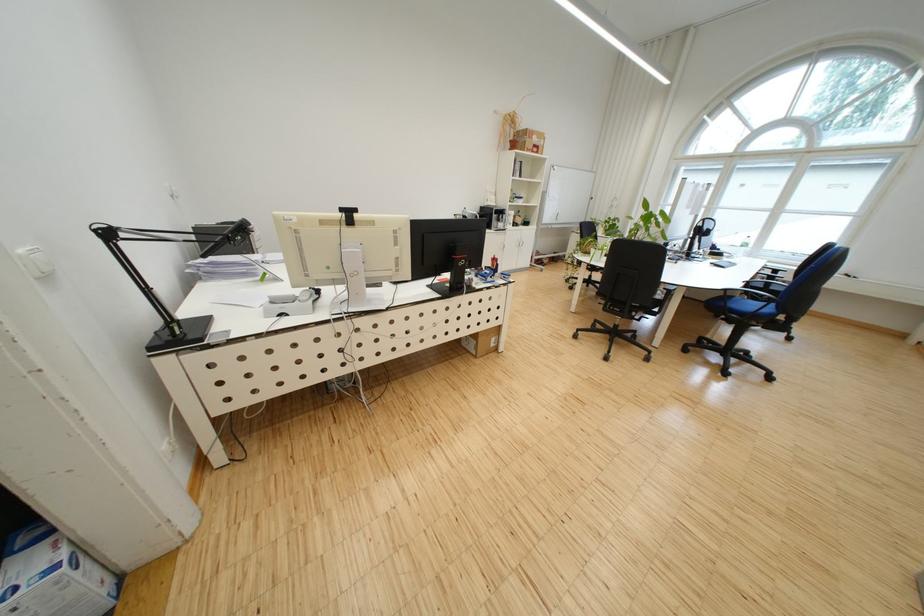
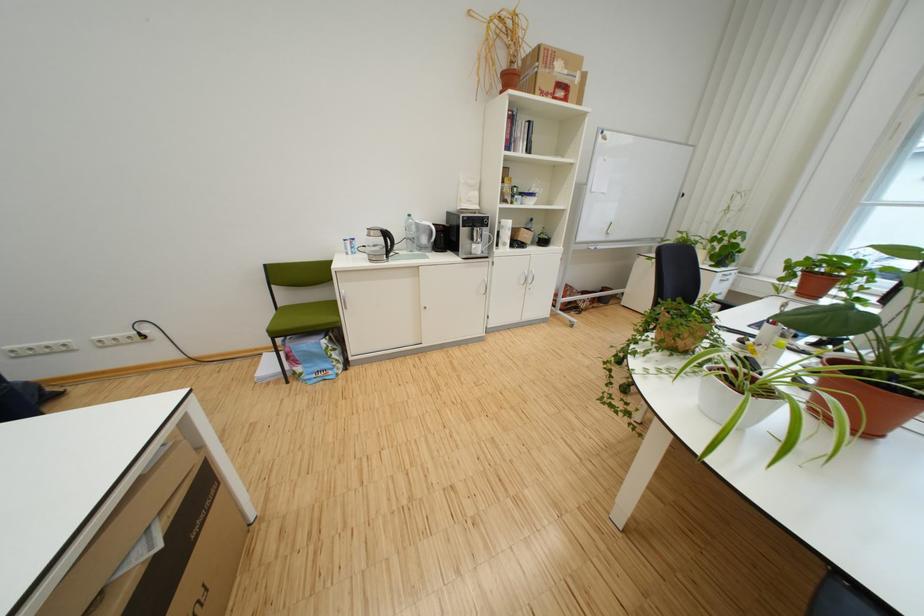
Where in the second image is the point corresponding to point (540, 152) from the first image?

(553, 95)